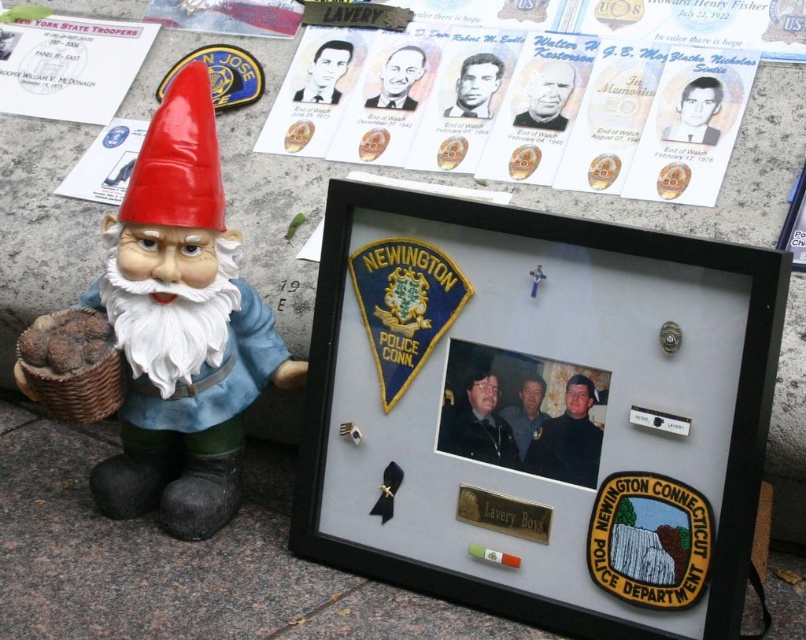
In the scene shown: What is the relationship between the size of the matte paper portraits at upper center and the metallic silver plaque at center in the framed display?

The matte paper portraits at upper center are larger in size than the metallic silver plaque at center.

You are an interior designer planning to place a new decorative item on the stone surface where the memorial is displayed. The new item will be placed at point coordinates of 0.75, 0.625. Will this placement overlap with the metallic silver plaque at center?

The metallic silver plaque at center is located at point coordinates of (503, 513). The new item at (503, 480) is 0.053 units to the left, so it will not overlap with the metallic silver plaque at center.

You are an interior designer asked to place a new decorative item between the matte black shadowbox at center and the metallic silver plaque at center. Which object should the new item be placed closer to if it needs to be positioned near the larger one?

The matte black shadowbox at center is larger than the metallic silver plaque at center, so the new item should be placed closer to the matte black shadowbox at center.